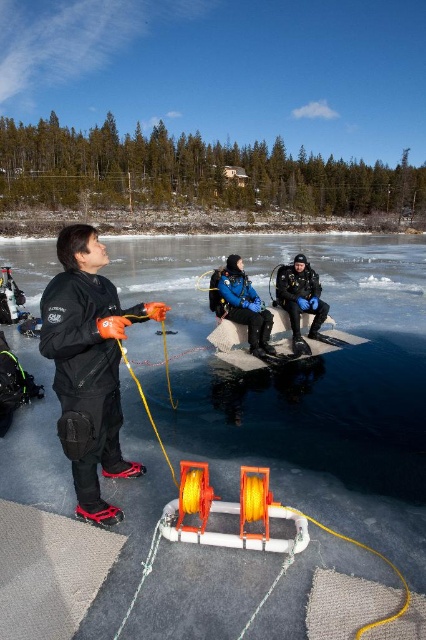
You are a safety officer overseeing the ice diving operation. The safety protocol requires that the distance between the transparent ice at center and the blue diving suit at center must be at least 15 meters to ensure safety. Based on the scene, is the current distance compliant with the protocol?

The transparent ice at center and blue diving suit at center are 13.14 meters apart, which is less than the required 15 meters. Therefore, the current distance does not comply with the safety protocol.

Based on the photo, based on the coordinates provided, which object is located at point (241, 305) in the image?

The point (241, 305) marks the blue matte diving suit at center.